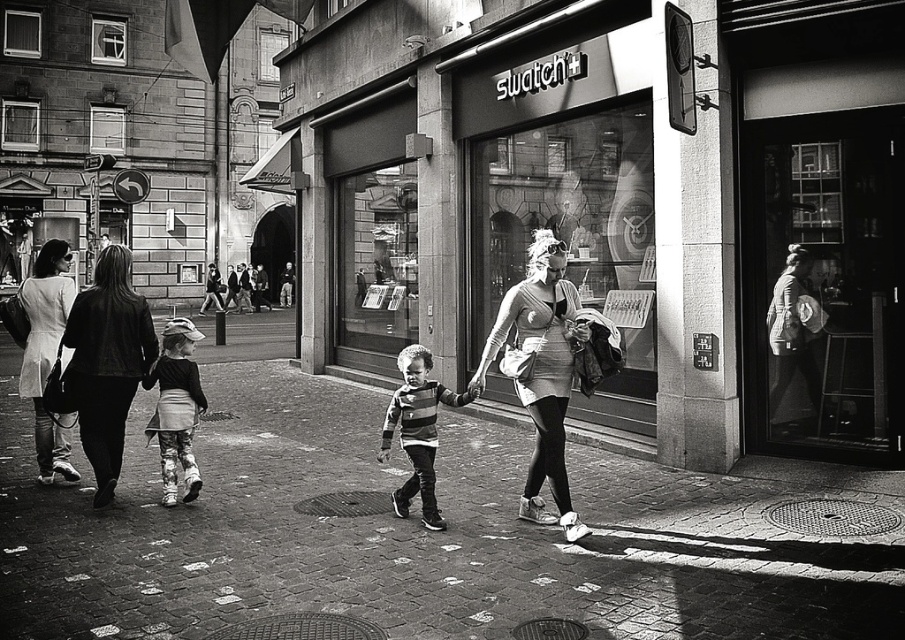
Looking at this image, you are a photographer standing at the end of the cobblestone street in the image. You want to take a closeup shot of the striped fabric shirt at center without moving closer. Can you zoom in enough to capture it clearly?

The striped fabric shirt at center is 5.48 meters away from viewer. Since the photographer cannot move closer, the zoom capability of the camera will determine if it can capture the shirt clearly from that distance.

You are a photographer who wants to capture the matte white dress at center and the matte white coat at left in a single frame. Since both items are white, how can you ensure they are distinguishable in the photo?

The matte white dress at center is positioned over the matte white coat at left, so positioning the camera to capture the overlapping layers will help distinguish them through their spatial arrangement.